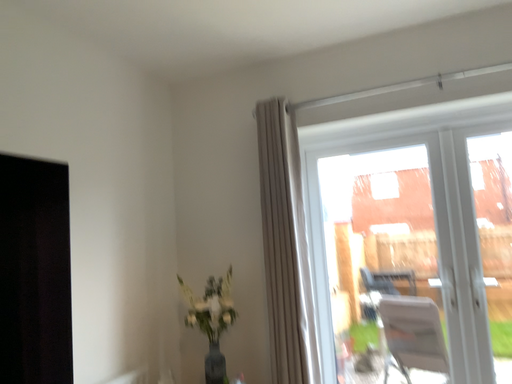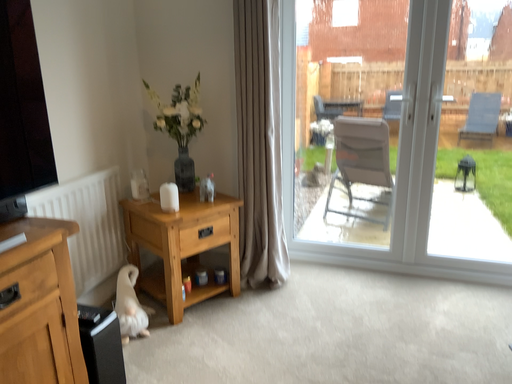
Question: How did the camera likely rotate when shooting the video?

Choices:
 (A) rotated left
 (B) rotated right

Answer: (B)